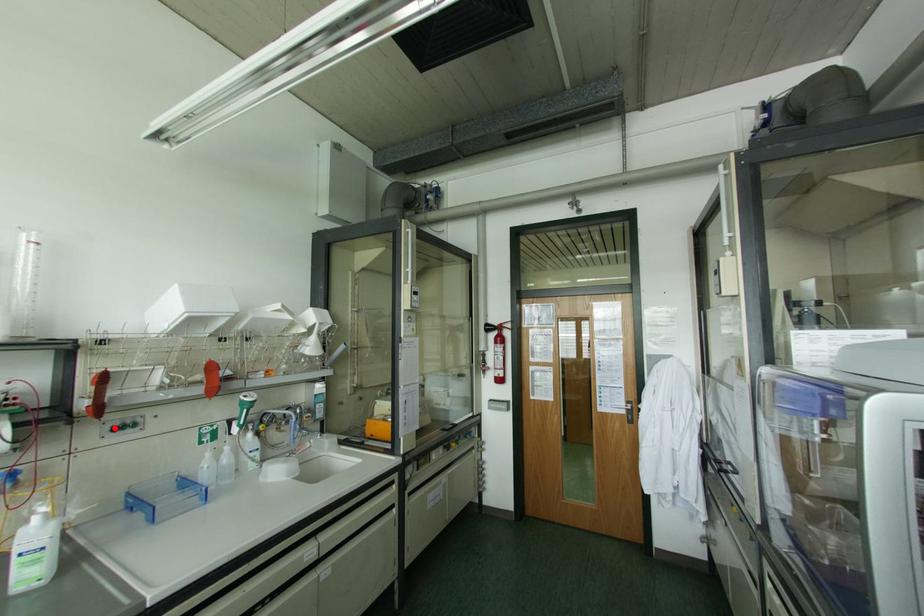
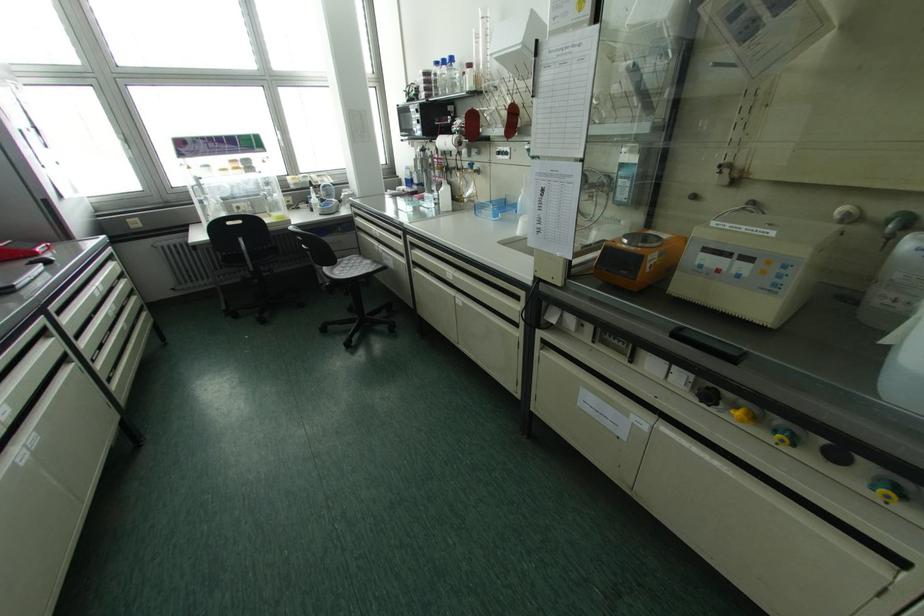
The point at the highlighted location is marked in the first image. Where is the corresponding point in the second image?

(497, 153)